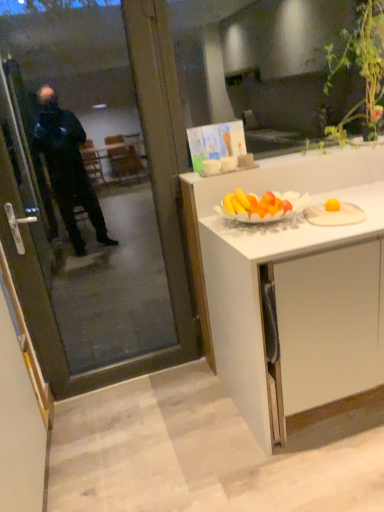
Question: In the image, is white wooden plate at right positioned in front of or behind transparent glass screen door at left?

Choices:
 (A) front
 (B) behind

Answer: (B)

Question: Choose the correct answer: Is white wooden plate at right inside transparent glass screen door at left or outside it?

Choices:
 (A) outside
 (B) inside

Answer: (A)

Question: Which object is the closest to the green leafy plant at upper right?

Choices:
 (A) transparent glass screen door at left
 (B) white matte cabinet at center
 (C) white wooden plate at right

Answer: (B)

Question: Estimate the real-world distances between objects in this image. Which object is farther from the white matte cabinet at center?

Choices:
 (A) transparent glass screen door at left
 (B) white wooden plate at right
 (C) green leafy plant at upper right

Answer: (A)